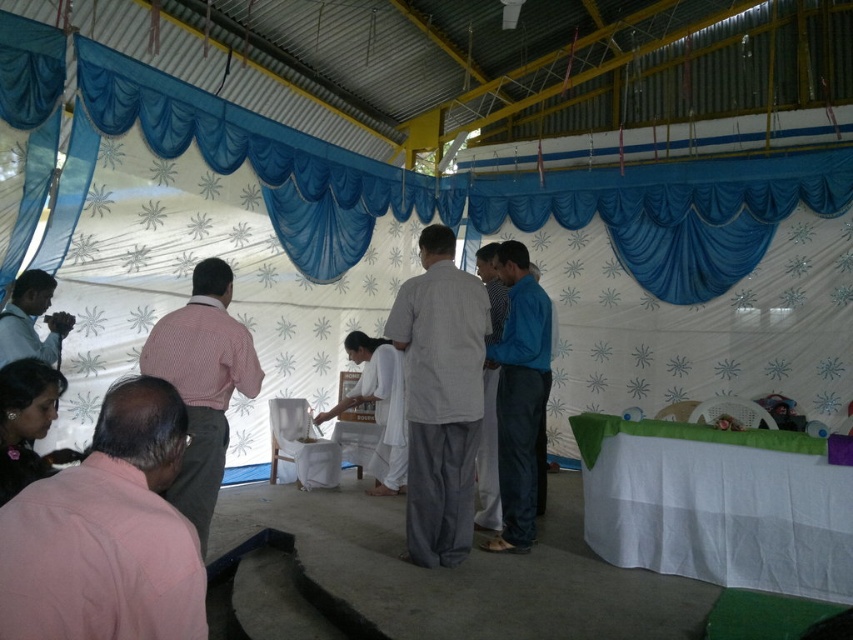
Can you confirm if light gray cotton shirt at center is positioned to the right of pink checkered shirt at left?

Indeed, light gray cotton shirt at center is positioned on the right side of pink checkered shirt at left.

Is light gray cotton shirt at center above pink checkered shirt at left?

No.

Between point (434, 428) and point (184, 332), which one is positioned behind?

The point (434, 428) is more distant.

This screenshot has height=640, width=853. Find the location of `light gray cotton shirt at center`. light gray cotton shirt at center is located at coordinates (440, 397).

What do you see at coordinates (202, 384) in the screenshot? The width and height of the screenshot is (853, 640). I see `pink checkered shirt at left` at bounding box center [202, 384].

Is point (166, 492) farther from viewer compared to point (517, 540)?

No, (166, 492) is closer to viewer.

Where is `pink checkered shirt at left`? pink checkered shirt at left is located at coordinates (202, 384).

Can you confirm if light gray cotton shirt at center is taller than matte black camera at left?

Yes, light gray cotton shirt at center is taller than matte black camera at left.

Can you confirm if light gray cotton shirt at center is wider than matte black camera at left?

Indeed, light gray cotton shirt at center has a greater width compared to matte black camera at left.

The image size is (853, 640). What do you see at coordinates (440, 397) in the screenshot?
I see `light gray cotton shirt at center` at bounding box center [440, 397].

At what (x,y) coordinates should I click in order to perform the action: click on light gray cotton shirt at center. Please return your answer as a coordinate pair (x, y). Looking at the image, I should click on (440, 397).